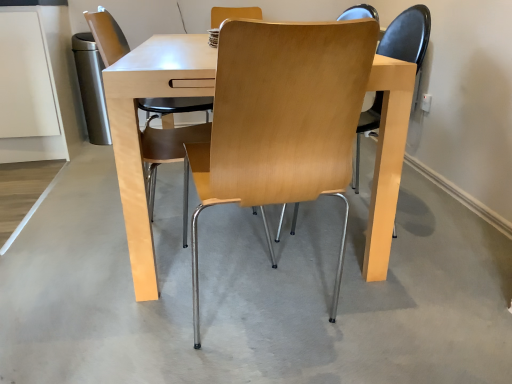
Question: Relative to light wood/matte chair at center, the 1th chair from the left, is light wood/chrome chair at center, the 1th chair when ordered from right to left, in front or behind?

Choices:
 (A) behind
 (B) front

Answer: (B)

Question: Would you say light wood/chrome chair at center, positioned as the 2th chair in left-to-right order, is to the left or to the right of light wood/matte chair at center, the 1th chair from the left, in the picture?

Choices:
 (A) right
 (B) left

Answer: (A)

Question: Based on their relative distances, which object is farther from the light wood/chrome chair at center, positioned as the 2th chair in left-to-right order?

Choices:
 (A) light wood/matte chair at center, the 1th chair from the left
 (B) light gray concrete at center

Answer: (A)

Question: Considering the real-world distances, which object is closest to the light gray concrete at center?

Choices:
 (A) light wood/chrome chair at center, the 1th chair when ordered from right to left
 (B) light wood/matte chair at center, the 1th chair from the left

Answer: (A)